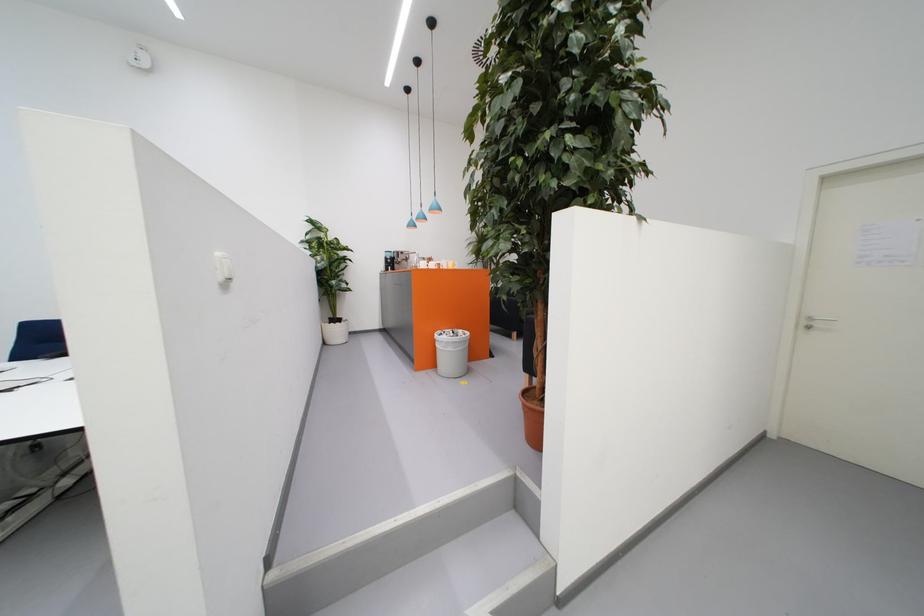
Identify the location of silver door handle. The width and height of the screenshot is (924, 616). (817, 322).